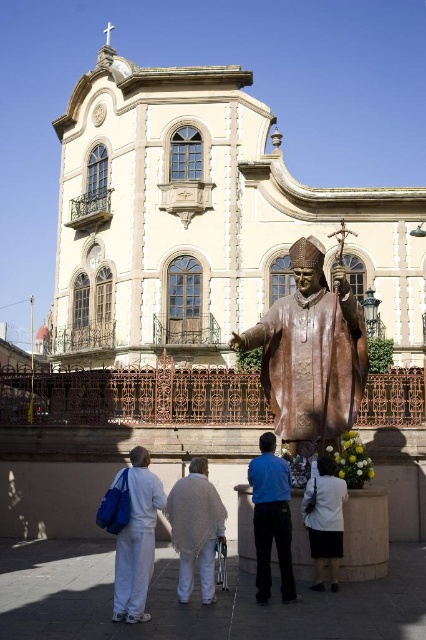
Question: Does blue fabric shirt at center appear on the left side of white fabric at lower center?

Choices:
 (A) no
 (B) yes

Answer: (B)

Question: Which of the following is the farthest from the observer?

Choices:
 (A) (336, 524)
 (B) (144, 595)
 (C) (265, 490)

Answer: (A)

Question: Does bronze statue at center appear under white cotton pants at lower left?

Choices:
 (A) yes
 (B) no

Answer: (B)

Question: Which point is closer to the camera?

Choices:
 (A) (282, 586)
 (B) (284, 348)

Answer: (A)

Question: Based on their relative distances, which object is farther from the blue fabric shirt at center?

Choices:
 (A) white cotton pants at lower left
 (B) white fabric at lower center
 (C) bronze statue at center

Answer: (C)

Question: Can you confirm if bronze statue at center is bigger than white cotton pants at lower left?

Choices:
 (A) yes
 (B) no

Answer: (A)